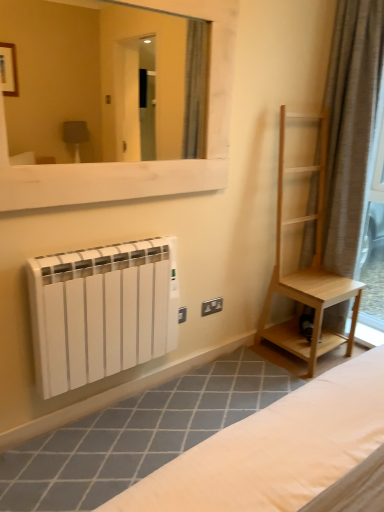
What do you see at coordinates (284, 453) in the screenshot? I see `white matte radiator at lower left` at bounding box center [284, 453].

At what (x,y) coordinates should I click in order to perform the action: click on brown textured curtain at right. Please return your answer as a coordinate pair (x, y). Image resolution: width=384 pixels, height=512 pixels. Looking at the image, I should click on (350, 126).

What do you see at coordinates (350, 126) in the screenshot? This screenshot has width=384, height=512. I see `brown textured curtain at right` at bounding box center [350, 126].

Based on the photo, in order to face white matte radiator at lower left, should I rotate leftwards or rightwards?

You should look left and rotate roughly 10.694 degrees.

Find the location of a particular element. black plastic electric outlet at lower center is located at coordinates (212, 306).

The height and width of the screenshot is (512, 384). What are the coordinates of `white matte radiator at lower left` in the screenshot? It's located at (284, 453).

Considering the relative sizes of brown textured curtain at right and white matte radiator at lower left in the image provided, is brown textured curtain at right taller than white matte radiator at lower left?

Indeed, brown textured curtain at right has a greater height compared to white matte radiator at lower left.

Between brown textured curtain at right and white matte radiator at lower left, which one is positioned in front?

Positioned in front is white matte radiator at lower left.

Considering the points (353, 148) and (323, 423), which point is behind, point (353, 148) or point (323, 423)?

The point (353, 148) is more distant.

Are brown textured curtain at right and white matte radiator at lower left making contact?

brown textured curtain at right and white matte radiator at lower left are not in contact.

Considering the sizes of objects white matte radiator at lower left and white matte radiator at lower left in the image provided, who is smaller, white matte radiator at lower left or white matte radiator at lower left?

white matte radiator at lower left is smaller.

Would you say white matte radiator at lower left is outside white matte radiator at lower left?

Yes, white matte radiator at lower left is located beyond the bounds of white matte radiator at lower left.

Is white matte radiator at lower left behind white matte radiator at lower left?

No, white matte radiator at lower left is in front of white matte radiator at lower left.

From a real-world perspective, which object rests below the other?

white matte radiator at lower left.

The height and width of the screenshot is (512, 384). Find the location of `furniture below the white matte radiator at lower left (from the image's perspective)`. furniture below the white matte radiator at lower left (from the image's perspective) is located at coordinates (284, 453).

Between white matte radiator at lower left and white matte radiator at lower left, which one is positioned behind?

white matte radiator at lower left is more distant.

In the scene shown: Is white matte radiator at lower left inside the boundaries of white matte radiator at lower left, or outside?

white matte radiator at lower left exists outside the volume of white matte radiator at lower left.

Based on the photo, are white matte radiator at lower left and white matte radiator at lower left beside each other?

No, white matte radiator at lower left is not touching white matte radiator at lower left.

Does white matte radiator at lower left come in front of white wooden mirror at upper center?

No, white matte radiator at lower left is further to the viewer.

Which object is positioned more to the right, white matte radiator at lower left or white wooden mirror at upper center?

Positioned to the right is white matte radiator at lower left.

From a real-world perspective, who is located higher, white matte radiator at lower left or white wooden mirror at upper center?

In real-world perspective, white wooden mirror at upper center is above.

Which is behind, point (312, 478) or point (0, 1)?

The point (0, 1) is farther.

Is point (267, 292) closer to camera compared to point (51, 115)?

Yes, it is in front of point (51, 115).

From the image's perspective, which is below, light wood shelf at right or white wooden mirror at upper center?

light wood shelf at right, from the image's perspective.

Are light wood shelf at right and white wooden mirror at upper center located far from each other?

Yes, light wood shelf at right and white wooden mirror at upper center are located far from each other.

From the image's perspective, relative to white matte radiator at lower left, is light wood shelf at right above or below?

Based on their image positions, light wood shelf at right is located above white matte radiator at lower left.

Is point (308, 127) less distant than point (154, 334)?

No, it is behind (154, 334).

Is light wood shelf at right closer to the viewer compared to white matte radiator at lower left?

That is False.

Which is more to the left, light wood shelf at right or white matte radiator at lower left?

white matte radiator at lower left.

Does black plastic electric outlet at lower center have a lesser width compared to white wooden mirror at upper center?

Indeed, black plastic electric outlet at lower center has a lesser width compared to white wooden mirror at upper center.

From a real-world perspective, is black plastic electric outlet at lower center located beneath white wooden mirror at upper center?

Yes, from a real-world perspective, black plastic electric outlet at lower center is under white wooden mirror at upper center.

In the image, is black plastic electric outlet at lower center positioned in front of or behind white wooden mirror at upper center?

black plastic electric outlet at lower center is behind white wooden mirror at upper center.

Which is behind, point (210, 300) or point (120, 27)?

Point (120, 27)

What are the coordinates of `curtain behind the white matte radiator at lower left` in the screenshot? It's located at (350, 126).

Locate an element on the screen. furniture that is under the white matte radiator at lower left (from a real-world perspective) is located at coordinates (284, 453).

Estimate the real-world distances between objects in this image. Which object is further from black plastic electric outlet at lower center, light wood shelf at right or white wooden mirror at upper center?

Based on the image, white wooden mirror at upper center appears to be further to black plastic electric outlet at lower center.

From the image, which object appears to be nearer to white matte radiator at lower left, white matte radiator at lower left or brown textured curtain at right?

white matte radiator at lower left lies closer to white matte radiator at lower left than the other object.

Considering their positions, is light wood shelf at right positioned closer to white matte radiator at lower left than white matte radiator at lower left?

white matte radiator at lower left is positioned closer to the anchor white matte radiator at lower left.

From the image, which object appears to be farther from white matte radiator at lower left, black plastic electric outlet at lower center or light wood shelf at right?

light wood shelf at right is positioned further to the anchor white matte radiator at lower left.

From the image, which object appears to be nearer to white matte radiator at lower left, light wood shelf at right or black plastic electric outlet at lower center?

black plastic electric outlet at lower center is closer to white matte radiator at lower left.

Considering their positions, is brown textured curtain at right positioned further to light wood shelf at right than black plastic electric outlet at lower center?

Based on the image, black plastic electric outlet at lower center appears to be further to light wood shelf at right.

When comparing their distances from white matte radiator at lower left, does brown textured curtain at right or white wooden mirror at upper center seem closer?

brown textured curtain at right is positioned closer to the anchor white matte radiator at lower left.

Looking at the image, which one is located closer to white matte radiator at lower left, black plastic electric outlet at lower center or white matte radiator at lower left?

black plastic electric outlet at lower center is positioned closer to the anchor white matte radiator at lower left.

You are a GUI agent. You are given a task and a screenshot of the screen. Output one action in this format:
    pyautogui.click(x=<x>, y=<y>)
    Task: Click on the shelf between black plastic electric outlet at lower center and brown textured curtain at right from left to right
    The width and height of the screenshot is (384, 512).
    Given the screenshot: What is the action you would take?
    pyautogui.click(x=301, y=251)

Locate an element on the screen. The width and height of the screenshot is (384, 512). electric outlet between white matte radiator at lower left and light wood shelf at right from left to right is located at coordinates (212, 306).

I want to click on shelf positioned between white wooden mirror at upper center and black plastic electric outlet at lower center from near to far, so click(301, 251).

Locate an element on the screen. The image size is (384, 512). shelf between white matte radiator at lower left and black plastic electric outlet at lower center from front to back is located at coordinates (301, 251).